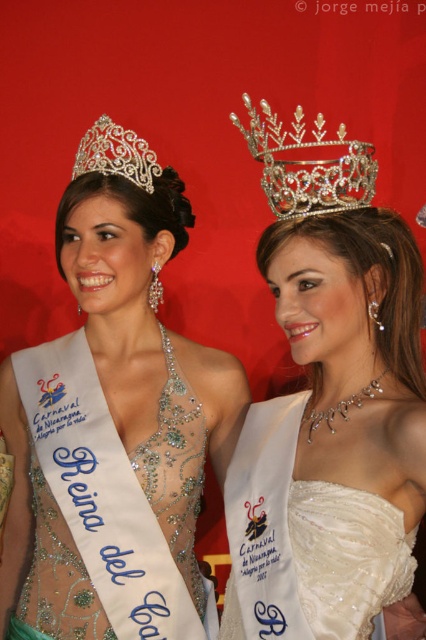
Question: Does matte silver tiara at upper center have a smaller size compared to silver/crystal tiara at upper center?

Choices:
 (A) no
 (B) yes

Answer: (A)

Question: Which object appears closest to the camera in this image?

Choices:
 (A) silver/crystal tiara at upper center
 (B) matte silver tiara at upper center
 (C) clear crystal crown at upper center

Answer: (C)

Question: Which object is positioned farthest from the silver/crystal tiara at upper center?

Choices:
 (A) matte silver tiara at upper center
 (B) clear crystal crown at upper center
 (C) ivory satin dress at center

Answer: (C)

Question: Does matte silver tiara at upper center have a greater width compared to silver/crystal tiara at upper center?

Choices:
 (A) no
 (B) yes

Answer: (B)

Question: Where is clear crystal crown at upper center located in relation to silver/crystal tiara at upper center in the image?

Choices:
 (A) right
 (B) left

Answer: (A)

Question: Among these points, which one is nearest to the camera?

Choices:
 (A) (115, 588)
 (B) (299, 118)

Answer: (B)